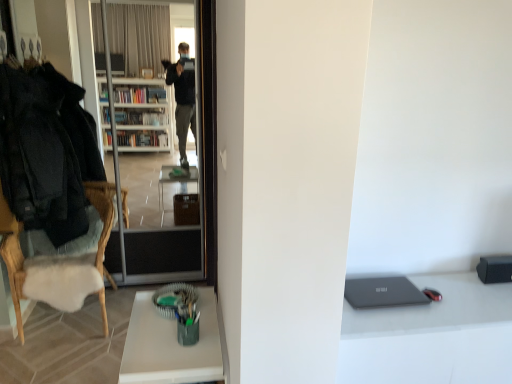
The image size is (512, 384). Find the location of `vacant area that is in front of white sheepskin cushion at left`. vacant area that is in front of white sheepskin cushion at left is located at coordinates (57, 362).